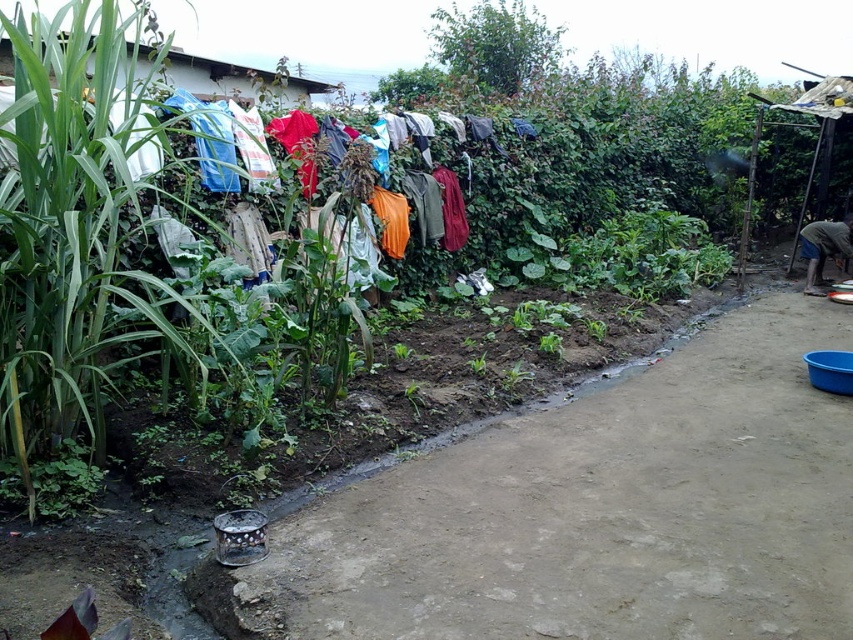
Is dark brown fabric at lower right smaller than green leafy plant at center?

No.

Between point (821, 241) and point (479, 356), which one is positioned behind?

The point (821, 241) is behind.

The width and height of the screenshot is (853, 640). I want to click on dark brown fabric at lower right, so click(x=828, y=237).

Which is more to the right, green leafy plant at left or green leafy plant at center?

green leafy plant at center is more to the right.

Identify the location of green leafy plant at left. The width and height of the screenshot is (853, 640). (71, 232).

Image resolution: width=853 pixels, height=640 pixels. Identify the location of green leafy plant at left. (71, 232).

Identify the location of green leafy plant at left. This screenshot has width=853, height=640. (71, 232).

Who is positioned more to the left, green leafy plant at left or dark brown fabric at lower right?

green leafy plant at left

Is point (22, 433) positioned after point (820, 241)?

No, it is not.

Locate an element on the screen. green leafy plant at left is located at coordinates point(71,232).